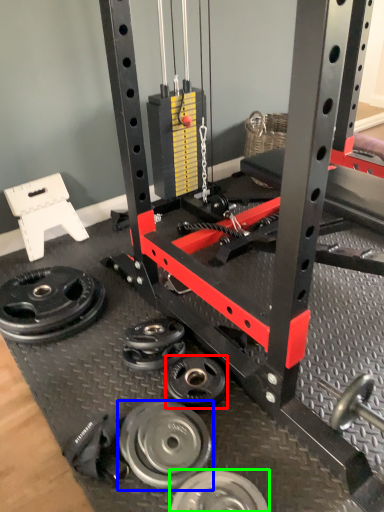
Question: Which is farther away from wheel (highlighted by a red box)? wheel (highlighted by a blue box) or wheel (highlighted by a green box)?

Choices:
 (A) wheel
 (B) wheel

Answer: (B)